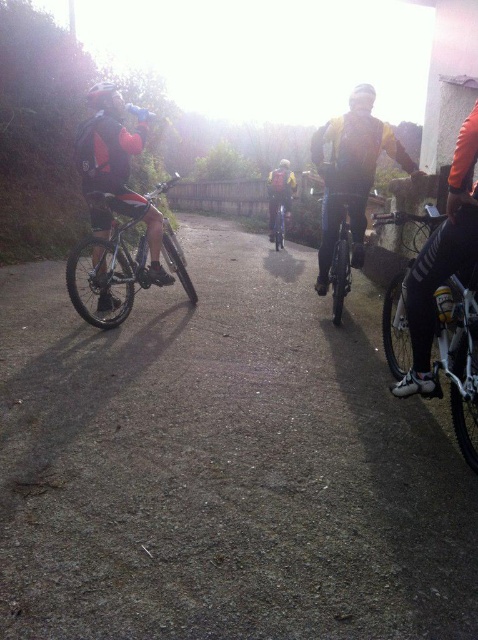
Question: Which point is closer to the camera?

Choices:
 (A) dirt track at center
 (B) matte black helmet at upper center
 (C) shiny metallic bicycle at center

Answer: (A)

Question: Which of the following is the farthest from the observer?

Choices:
 (A) (394, 275)
 (B) (150, 577)
 (C) (108, 84)

Answer: (A)

Question: Does shiny metallic bicycle at center have a greater width compared to matte black helmet at left?

Choices:
 (A) no
 (B) yes

Answer: (B)

Question: Is shiny metallic bicycle at left bigger than matte yellow jacket at center?

Choices:
 (A) yes
 (B) no

Answer: (A)

Question: Is shiny silver bicycle at center to the right of matte black helmet at left from the viewer's perspective?

Choices:
 (A) no
 (B) yes

Answer: (B)

Question: Which object is the farthest from the shiny metallic bicycle at left?

Choices:
 (A) matte black helmet at upper center
 (B) matte black helmet at left

Answer: (A)